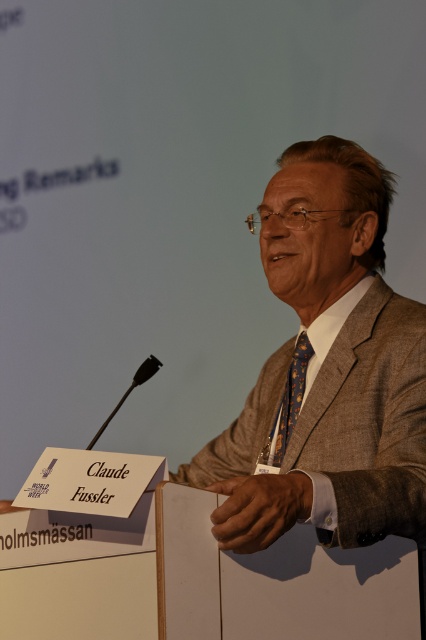
Does brown textured suit at center have a greater width compared to blue dotted fabric tie at center?

Indeed, brown textured suit at center has a greater width compared to blue dotted fabric tie at center.

Is point (221, 531) in front of point (313, 352)?

Yes, point (221, 531) is in front of point (313, 352).

Does point (324, 376) lie behind point (290, 412)?

No, (324, 376) is in front of (290, 412).

What are the coordinates of `brown textured suit at center` in the screenshot? It's located at (328, 369).